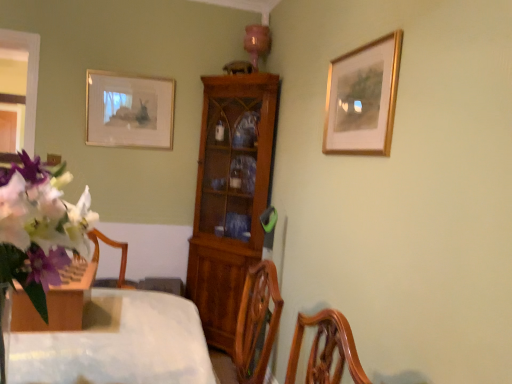
Question: Is white matte flower at left bigger than gold/golden picture frame at upper right, the 2th picture frame when ordered from left to right?

Choices:
 (A) yes
 (B) no

Answer: (A)

Question: Is gold/golden picture frame at upper right, the 2th picture frame when ordered from left to right, at the back of white matte flower at left?

Choices:
 (A) yes
 (B) no

Answer: (A)

Question: From the image's perspective, does white matte flower at left appear lower than gold/golden picture frame at upper right, which ranks as the 1th picture frame in right-to-left order?

Choices:
 (A) no
 (B) yes

Answer: (B)

Question: From a real-world perspective, is white matte flower at left on top of gold/golden picture frame at upper right, the 2th picture frame when ordered from left to right?

Choices:
 (A) no
 (B) yes

Answer: (A)

Question: Is white matte flower at left far away from gold/golden picture frame at upper right, which ranks as the 1th picture frame in right-to-left order?

Choices:
 (A) yes
 (B) no

Answer: (A)

Question: Is white matte flower at left closer to the viewer compared to gold/golden picture frame at upper right, which ranks as the 1th picture frame in right-to-left order?

Choices:
 (A) yes
 (B) no

Answer: (A)

Question: Can wooden cabinet at center be found inside white matte flower at left?

Choices:
 (A) no
 (B) yes

Answer: (A)

Question: Is white matte flower at left wider than wooden cabinet at center?

Choices:
 (A) no
 (B) yes

Answer: (A)

Question: Can you confirm if white matte flower at left is taller than wooden cabinet at center?

Choices:
 (A) yes
 (B) no

Answer: (B)

Question: Is white matte flower at left turned away from wooden cabinet at center?

Choices:
 (A) no
 (B) yes

Answer: (A)

Question: From a real-world perspective, is white matte flower at left below wooden cabinet at center?

Choices:
 (A) no
 (B) yes

Answer: (A)

Question: Is white matte flower at left positioned far away from wooden cabinet at center?

Choices:
 (A) yes
 (B) no

Answer: (A)

Question: Is wooden cabinet at center at the back of matte white picture frame at upper left, the second picture frame in the right-to-left sequence?

Choices:
 (A) no
 (B) yes

Answer: (A)